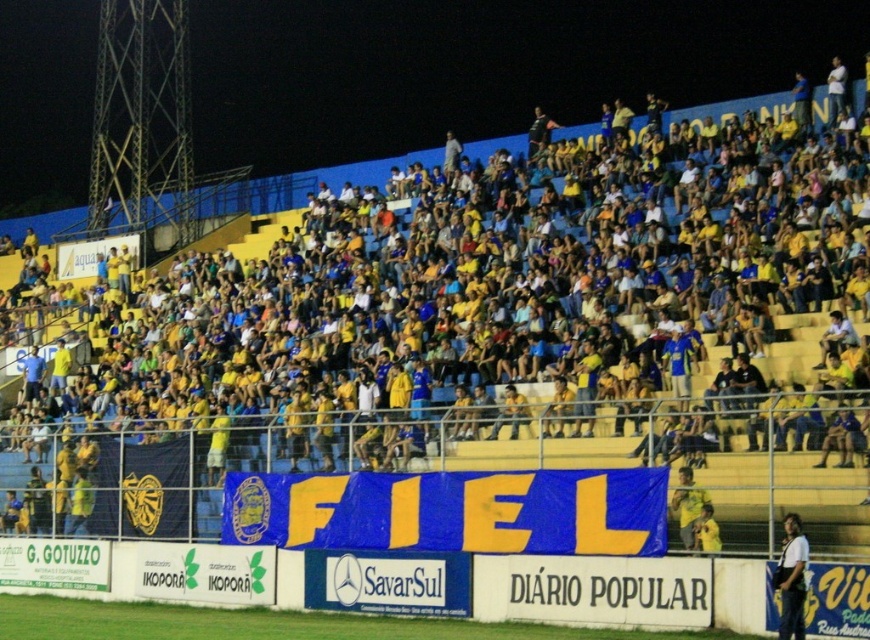
You are a photographer standing at the center of the stadium. You want to take a photo of the white shirt at lower right. Which direction should you move to get a better shot?

The white shirt at lower right is located at point (791, 579), so you should move to the right and slightly downward to frame it properly.

You are a photographer at the stadium and want to capture both the white shirt at lower right and the yellow jersey at lower right in a single shot. Which clothing item will appear narrower in the photo?

The white shirt at lower right will appear narrower in the photo since it has a lesser width compared to the yellow jersey at lower right according to the description.